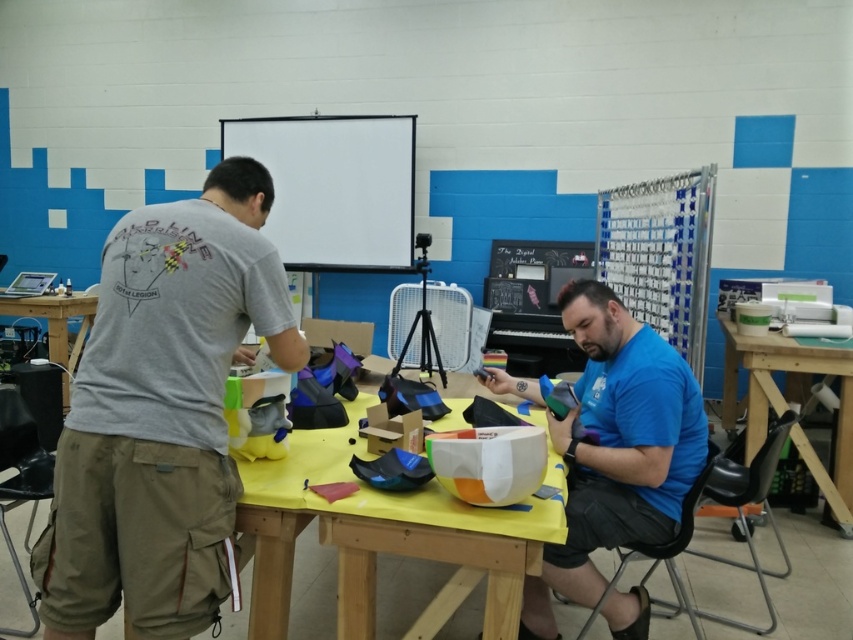
What is located at the coordinate point [616,449] in the image?

The blue matte shirt at center is located at the coordinate point [616,449].

Based on the coordinates provided, which object is located at point (x=161, y=413) in the image?

The gray cotton t shirt at left is located at point (x=161, y=413).

What is the 2D coordinate of the yellow matte table at center in the image?

The 2D coordinate of the yellow matte table at center is at point (381, 538).